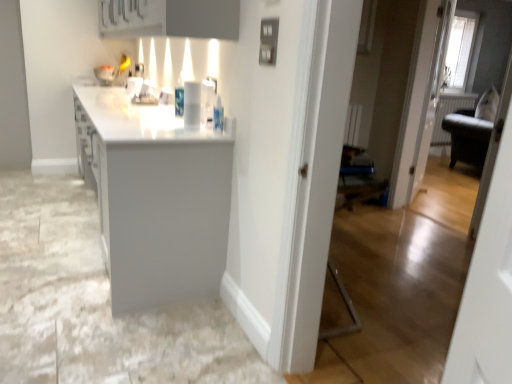
Locate an element on the screen. Image resolution: width=512 pixels, height=384 pixels. white glossy cup at center is located at coordinates (192, 105).

Image resolution: width=512 pixels, height=384 pixels. In order to click on white glossy cup at center in this screenshot , I will do `click(192, 105)`.

Considering the points (164, 283) and (216, 26), which point is in front, point (164, 283) or point (216, 26)?

Point (216, 26)

From the image's perspective, which is above, white glossy countertop at center or matte gray cabinet at upper center?

matte gray cabinet at upper center, from the image's perspective.

Looking at this image, is white glossy countertop at center smaller than matte gray cabinet at upper center?

No, white glossy countertop at center is not smaller than matte gray cabinet at upper center.

How distant is white glossy countertop at center from white glossy cup at center?

white glossy countertop at center is 17.12 inches from white glossy cup at center.

Would you say white glossy countertop at center is outside white glossy cup at center?

Absolutely, white glossy countertop at center is external to white glossy cup at center.

In the scene shown: Considering the relative sizes of white glossy countertop at center and white glossy cup at center in the image provided, is white glossy countertop at center thinner than white glossy cup at center?

No, white glossy countertop at center is not thinner than white glossy cup at center.

Based on the photo, is white glossy countertop at center taller or shorter than white glossy cup at center?

Clearly, white glossy countertop at center is taller compared to white glossy cup at center.

Which object is positioned more to the right, matte gray cabinet at upper center or white glossy countertop at center?

matte gray cabinet at upper center is more to the right.

Identify the location of cabinetry that appears above the white glossy countertop at center (from a real-world perspective). (170, 18).

Is matte gray cabinet at upper center smaller than white glossy countertop at center?

Yes, matte gray cabinet at upper center is smaller than white glossy countertop at center.

Is matte gray cabinet at upper center spatially inside white glossy countertop at center, or outside of it?

matte gray cabinet at upper center cannot be found inside white glossy countertop at center.

How many degrees apart are the facing directions of matte gray cabinet at upper center and white glossy cup at center?

matte gray cabinet at upper center and white glossy cup at center are facing 3.75 degrees away from each other.

Does matte gray cabinet at upper center turn towards white glossy cup at center?

No, matte gray cabinet at upper center is not facing towards white glossy cup at center.

Can you confirm if matte gray cabinet at upper center is smaller than white glossy cup at center?

No, matte gray cabinet at upper center is not smaller than white glossy cup at center.

Is matte gray cabinet at upper center in front of or behind white glossy cup at center in the image?

Visually, matte gray cabinet at upper center is located in front of white glossy cup at center.

Considering the positions of objects white glossy cup at center and white glossy countertop at center in the image provided, who is more to the left, white glossy cup at center or white glossy countertop at center?

From the viewer's perspective, white glossy countertop at center appears more on the left side.

Does white glossy cup at center have a greater height compared to white glossy countertop at center?

No.

This screenshot has width=512, height=384. Find the location of `appliance located behind the white glossy countertop at center`. appliance located behind the white glossy countertop at center is located at coordinates coord(192,105).

Considering the positions of point (184, 101) and point (178, 257), is point (184, 101) closer or farther from the camera than point (178, 257)?

Clearly, point (184, 101) is closer to the camera than point (178, 257).

Is point (197, 123) in front of point (119, 23)?

Yes, it is in front of point (119, 23).

Which is correct: white glossy cup at center is inside matte gray cabinet at upper center, or outside of it?

white glossy cup at center exists outside the volume of matte gray cabinet at upper center.

Who is taller, white glossy cup at center or matte gray cabinet at upper center?

With more height is matte gray cabinet at upper center.

Looking at the image, does white glossy cup at center seem bigger or smaller compared to matte gray cabinet at upper center?

In the image, white glossy cup at center appears to be smaller than matte gray cabinet at upper center.

Locate an element on the screen. This screenshot has height=384, width=512. cabinetry above the white glossy countertop at center (from a real-world perspective) is located at coordinates (170, 18).

At what (x,y) coordinates should I click in order to perform the action: click on countertop in front of the white glossy cup at center. Please return your answer as a coordinate pair (x, y). This screenshot has width=512, height=384. Looking at the image, I should click on (155, 198).

Considering their positions, is white glossy cup at center positioned further to white glossy countertop at center than matte gray cabinet at upper center?

matte gray cabinet at upper center.

When comparing their distances from white glossy cup at center, does white glossy countertop at center or matte gray cabinet at upper center seem further?

matte gray cabinet at upper center lies further to white glossy cup at center than the other object.

Looking at the image, which one is located closer to white glossy cup at center, matte gray cabinet at upper center or white glossy countertop at center?

white glossy countertop at center.

Looking at the image, which one is located closer to matte gray cabinet at upper center, white glossy countertop at center or white glossy cup at center?

Among the two, white glossy cup at center is located nearer to matte gray cabinet at upper center.

In the scene shown: When comparing their distances from white glossy countertop at center, does matte gray cabinet at upper center or white glossy cup at center seem further?

matte gray cabinet at upper center.

Looking at the image, which one is located closer to matte gray cabinet at upper center, white glossy cup at center or white glossy countertop at center?

white glossy cup at center is positioned closer to the anchor matte gray cabinet at upper center.

This screenshot has width=512, height=384. Find the location of `appliance between matte gray cabinet at upper center and white glossy countertop at center in the up-down direction`. appliance between matte gray cabinet at upper center and white glossy countertop at center in the up-down direction is located at coordinates (192, 105).